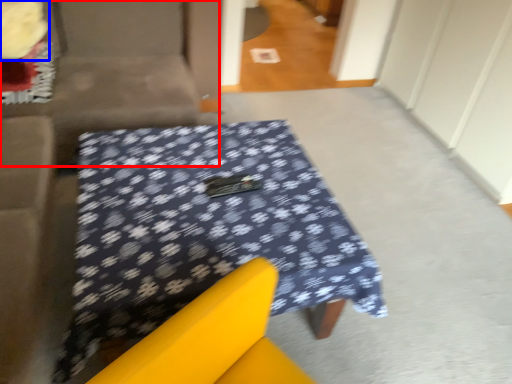
Question: Among these objects, which one is nearest to the camera, couch (highlighted by a red box) or flower (highlighted by a blue box)?

Choices:
 (A) couch
 (B) flower

Answer: (A)